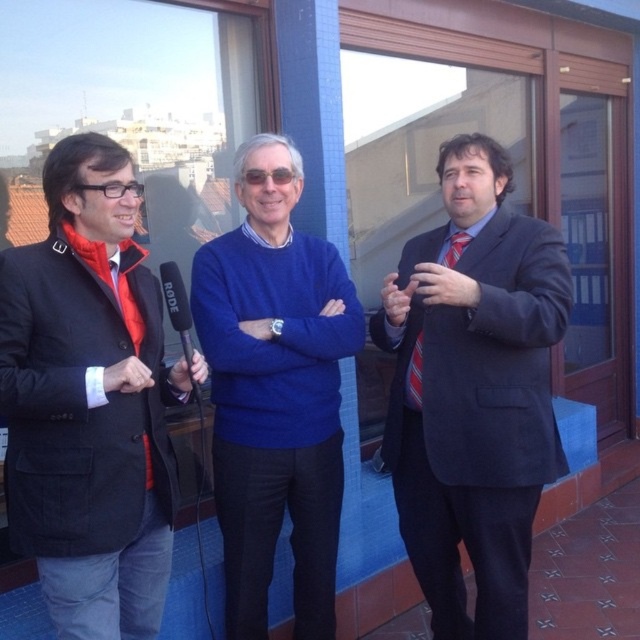
You are organizing a small event and need to place the black plastic microphone at center and the red satin tie at left on a shelf. If the shelf can only accommodate items that take up the same amount of space, which item should you prioritize placing first?

The black plastic microphone at center should be prioritized because it occupies less space than the red satin tie at left, making it easier to fit on the shelf first.

You are standing at the point labeled point (172, 291) and want to take a photo of the three people in the scene. The camera you have can focus on subjects within 2 meters. Will you be able to capture all three individuals clearly in your photo?

The point labeled point (172, 291) and the camera are 1.92 meters apart, which is within the 2 meter focus range. Therefore, you can capture all three individuals clearly in your photo.

You are a photographer setting up for a group photo. You notice the black plastic microphone at center and the red satin tie at left. Which object should you focus on first if you want to capture both in the same frame without adjusting your camera angle?

The black plastic microphone at center is above the red satin tie at left, so focusing on the microphone first ensures both objects remain in the frame as the tie is lower down.